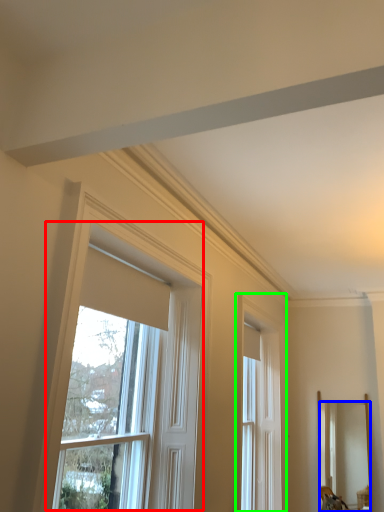
Question: Estimate the real-world distances between objects in this image. Which object is closer to window (highlighted by a red box), mirror (highlighted by a blue box) or window (highlighted by a green box)?

Choices:
 (A) mirror
 (B) window

Answer: (B)